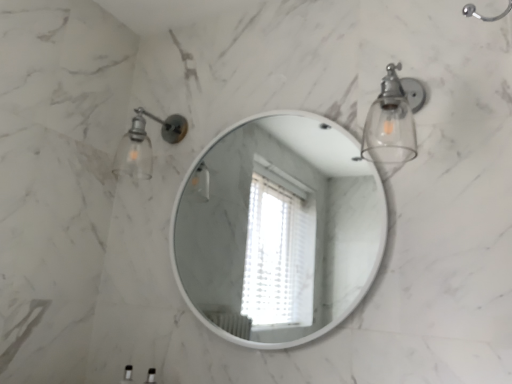
Question: Looking at the image, does clear glass sconce at upper right, placed as the first light fixture when sorted from front to back, seem bigger or smaller compared to white glossy mirror at center?

Choices:
 (A) small
 (B) big

Answer: (A)

Question: Is point (379, 102) positioned closer to the camera than point (317, 256)?

Choices:
 (A) closer
 (B) farther

Answer: (A)

Question: Which of these objects is positioned closest to the white glossy mirror at center?

Choices:
 (A) matte glass sconce at upper left, acting as the 2th light fixture starting from the right
 (B) clear glass sconce at upper right, placed as the first light fixture when sorted from front to back

Answer: (A)

Question: Which object is the closest to the clear glass sconce at upper right, placed as the first light fixture when sorted from front to back?

Choices:
 (A) matte glass sconce at upper left, which is counted as the 2th light fixture, starting from the front
 (B) white glossy mirror at center

Answer: (A)